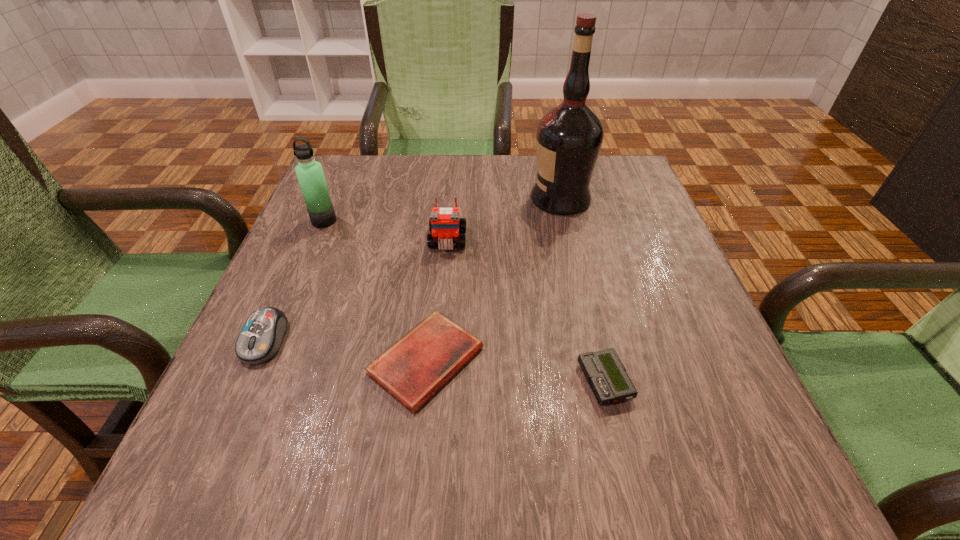
Find the location of a particular element. vacant area located on the front-facing side of the fourth shortest object is located at coordinates (444, 282).

Identify the location of free space located on the wheel side of the computer mouse. (204, 476).

Locate an element on the screen. vacant space situated 0.050m on the right of the second shortest object is located at coordinates (660, 382).

The width and height of the screenshot is (960, 540). I want to click on free location located 0.350m on the right of the shortest object, so click(x=691, y=361).

The width and height of the screenshot is (960, 540). In order to click on object located at the far edge in this screenshot , I will do `click(569, 137)`.

What are the coordinates of `thermos bottle at the left edge` in the screenshot? It's located at (309, 172).

At what (x,y) coordinates should I click in order to perform the action: click on computer mouse positioned at the left edge. Please return your answer as a coordinate pair (x, y). The width and height of the screenshot is (960, 540). Looking at the image, I should click on (261, 337).

Identify the location of object present at the right edge. The image size is (960, 540). (569, 137).

Image resolution: width=960 pixels, height=540 pixels. I want to click on object that is positioned at the far right corner, so click(x=569, y=137).

Identify the location of blank space at the far edge of the desktop. (494, 159).